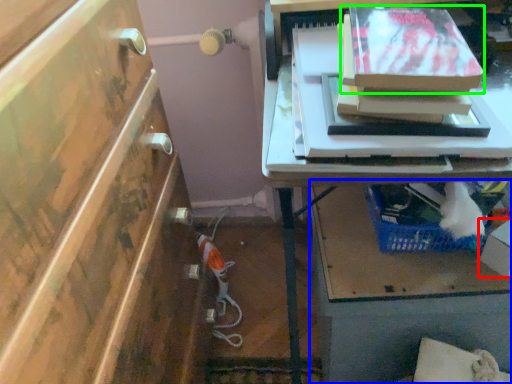
Question: Considering the real-world distances, which object is closest to box (highlighted by a red box)? vanity (highlighted by a blue box) or storage box (highlighted by a green box).

Choices:
 (A) vanity
 (B) storage box

Answer: (A)